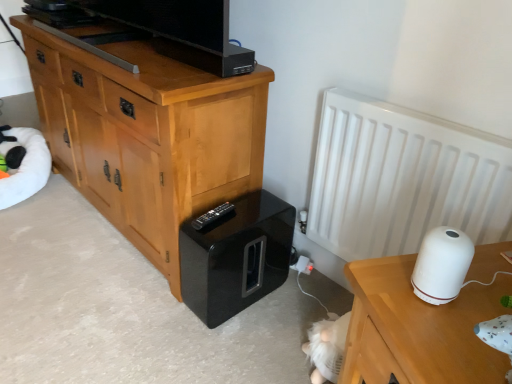
Locate an element on the screen. The image size is (512, 384). free location in front of glossy black speaker at lower center is located at coordinates tap(229, 346).